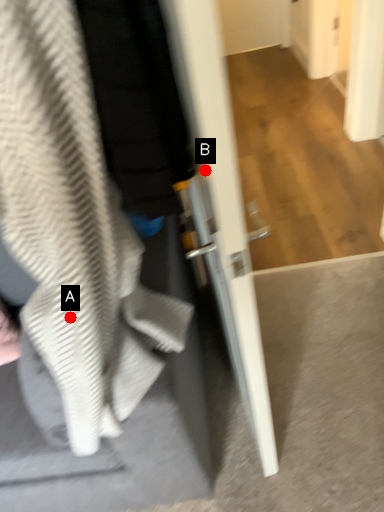
Question: Two points are circled on the image, labeled by A and B beside each circle. Which point appears closest to the camera in this image?

Choices:
 (A) A is closer
 (B) B is closer

Answer: (B)